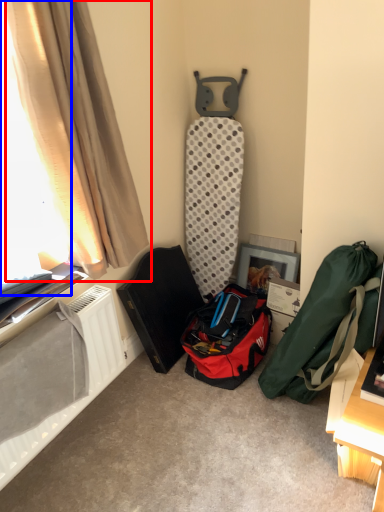
Question: Which point is further to the camera, curtain (highlighted by a red box) or window screen (highlighted by a blue box)?

Choices:
 (A) curtain
 (B) window screen

Answer: (A)